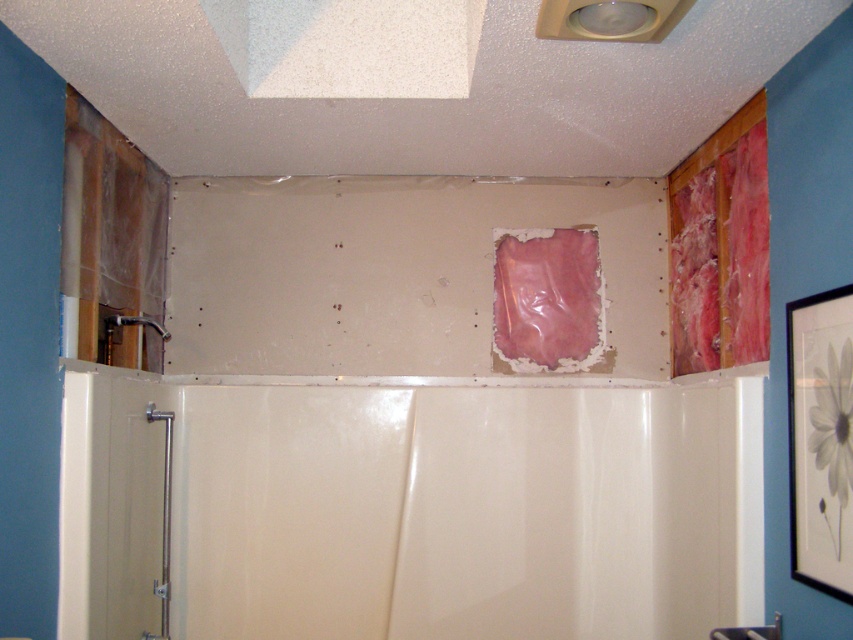
Question: Which object is the farthest from the white glossy bathtub at center?

Choices:
 (A) pink paper at center
 (B) matte silver faucet at left

Answer: (B)

Question: Which object appears farthest from the camera in this image?

Choices:
 (A) pink paper at center
 (B) matte silver faucet at left

Answer: (A)

Question: Can you confirm if white glossy bathtub at center is positioned to the left of matte silver faucet at left?

Choices:
 (A) no
 (B) yes

Answer: (A)

Question: Which object is positioned farthest from the white glossy bathtub at center?

Choices:
 (A) pink paper at center
 (B) matte silver faucet at left

Answer: (B)

Question: Can you confirm if white glossy bathtub at center is thinner than matte silver faucet at left?

Choices:
 (A) yes
 (B) no

Answer: (B)

Question: Does pink paper at center have a smaller size compared to matte silver faucet at left?

Choices:
 (A) yes
 (B) no

Answer: (B)